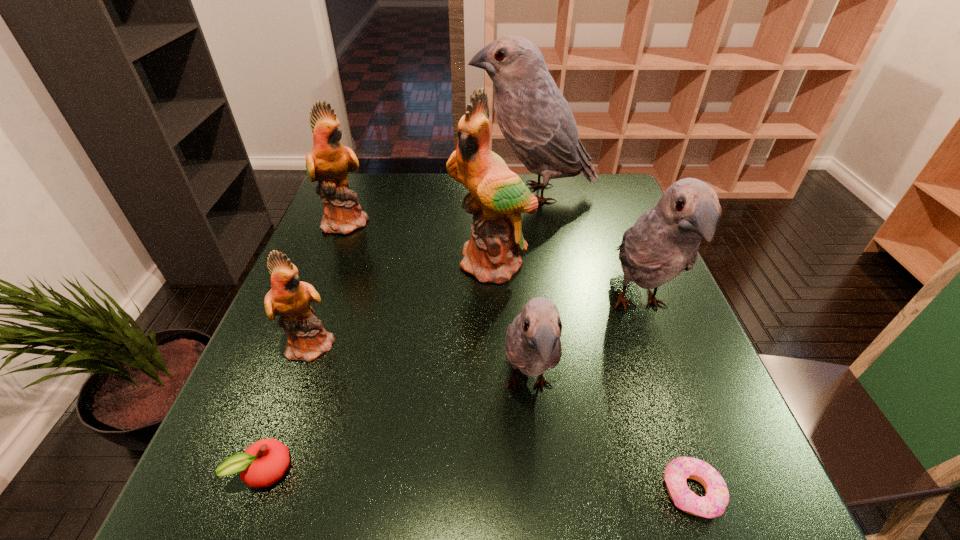
Where is `vacant position located on the back of the doughnut`? The width and height of the screenshot is (960, 540). vacant position located on the back of the doughnut is located at coordinates (649, 366).

At what (x,y) coordinates should I click in order to perform the action: click on apple present at the near edge. Please return your answer as a coordinate pair (x, y). This screenshot has width=960, height=540. Looking at the image, I should click on (263, 463).

Where is `doughnut that is at the near edge`? This screenshot has width=960, height=540. doughnut that is at the near edge is located at coordinates (713, 504).

The height and width of the screenshot is (540, 960). What are the coordinates of `apple that is at the left edge` in the screenshot? It's located at (263, 463).

This screenshot has width=960, height=540. What are the coordinates of `doughnut that is at the right edge` in the screenshot? It's located at (713, 504).

I want to click on object positioned at the far left corner, so click(x=328, y=162).

Locate an element on the screen. The width and height of the screenshot is (960, 540). object positioned at the near left corner is located at coordinates (263, 463).

The image size is (960, 540). I want to click on object at the far right corner, so click(536, 120).

The width and height of the screenshot is (960, 540). Find the location of `object at the near right corner`. object at the near right corner is located at coordinates (713, 504).

This screenshot has height=540, width=960. In order to click on free space at the far edge of the desktop in this screenshot , I will do `click(430, 184)`.